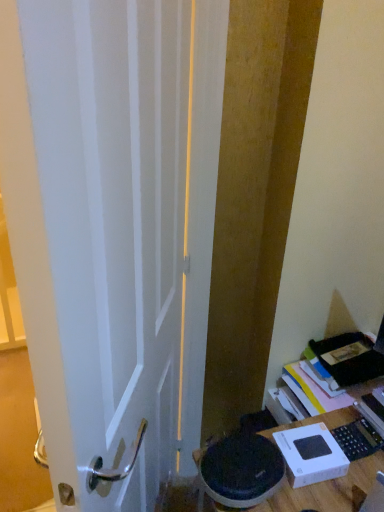
What do you see at coordinates (123, 231) in the screenshot?
I see `white glossy door at center` at bounding box center [123, 231].

Measure the distance between point (71, 384) and camera.

Point (71, 384) and camera are 22.20 inches apart.

At what (x,y) coordinates should I click in order to perform the action: click on white glossy door at center. Please return your answer as a coordinate pair (x, y). Looking at the image, I should click on (123, 231).

Describe the element at coordinates (311, 455) in the screenshot. This screenshot has height=512, width=384. I see `white cardboard box at lower right` at that location.

Where is `white cardboard box at lower right`? This screenshot has height=512, width=384. white cardboard box at lower right is located at coordinates (311, 455).

This screenshot has height=512, width=384. I want to click on white glossy door at center, so coord(123,231).

Between white cardboard box at lower right and white glossy door at center, which one appears on the right side from the viewer's perspective?

Positioned to the right is white cardboard box at lower right.

Is white cardboard box at lower right in front of white glossy door at center?

That is False.

Does point (338, 449) come farther from viewer compared to point (33, 1)?

Yes, point (338, 449) is farther from viewer.

From the image's perspective, between white cardboard box at lower right and white glossy door at center, which one is located above?

white glossy door at center, from the image's perspective.

From a real-world perspective, is white cardboard box at lower right located beneath white glossy door at center?

Yes, from a real-world perspective, white cardboard box at lower right is beneath white glossy door at center.

Which object is wider, white cardboard box at lower right or white glossy door at center?

white cardboard box at lower right.

Does white cardboard box at lower right have a lesser height compared to white glossy door at center?

Yes.

Is white cardboard box at lower right smaller than white glossy door at center?

Yes.

Can we say white cardboard box at lower right lies outside white glossy door at center?

Yes, white cardboard box at lower right is not within white glossy door at center.

Does white cardboard box at lower right touch white glossy door at center?

white cardboard box at lower right is not next to white glossy door at center, and they're not touching.

Is white cardboard box at lower right aimed at white glossy door at center?

No, white cardboard box at lower right is not oriented towards white glossy door at center.

In the image, there is a white glossy door at center. What are the coordinates of `cardboard box below it (from a real-world perspective)` in the screenshot? It's located at (311, 455).

Does white glossy door at center appear on the right side of white cardboard box at lower right?

Incorrect, white glossy door at center is not on the right side of white cardboard box at lower right.

Who is more distant, white glossy door at center or white cardboard box at lower right?

white cardboard box at lower right is more distant.

Is point (184, 351) farther from camera compared to point (289, 440)?

Yes, point (184, 351) is farther from viewer.

From the image's perspective, is white glossy door at center located beneath white cardboard box at lower right?

No, from the image's perspective, white glossy door at center is not beneath white cardboard box at lower right.

From a real-world perspective, relative to white cardboard box at lower right, is white glossy door at center vertically above or below?

From a real-world perspective, white glossy door at center is physically above white cardboard box at lower right.

Between white glossy door at center and white cardboard box at lower right, which one has smaller width?

With smaller width is white glossy door at center.

Which of these two, white glossy door at center or white cardboard box at lower right, stands shorter?

white cardboard box at lower right.

Is white glossy door at center bigger than white cardboard box at lower right?

Yes, white glossy door at center is bigger than white cardboard box at lower right.

Can we say white glossy door at center lies outside white cardboard box at lower right?

white glossy door at center is positioned outside white cardboard box at lower right.

In the scene shown: Are white glossy door at center and white cardboard box at lower right beside each other?

No, white glossy door at center is not next to white cardboard box at lower right.

Based on the photo, is white glossy door at center aimed at white cardboard box at lower right?

Yes, white glossy door at center faces towards white cardboard box at lower right.

How different are the orientations of white glossy door at center and white cardboard box at lower right in degrees?

The angle between the facing direction of white glossy door at center and the facing direction of white cardboard box at lower right is 85.5 degrees.

Where is `cardboard box below the white glossy door at center (from a real-world perspective)`? Image resolution: width=384 pixels, height=512 pixels. cardboard box below the white glossy door at center (from a real-world perspective) is located at coordinates (311, 455).

The width and height of the screenshot is (384, 512). Find the location of `cardboard box below the white glossy door at center (from a real-world perspective)`. cardboard box below the white glossy door at center (from a real-world perspective) is located at coordinates (311, 455).

At what (x,y) coordinates should I click in order to perform the action: click on door in front of the white cardboard box at lower right. Please return your answer as a coordinate pair (x, y). Looking at the image, I should click on point(123,231).